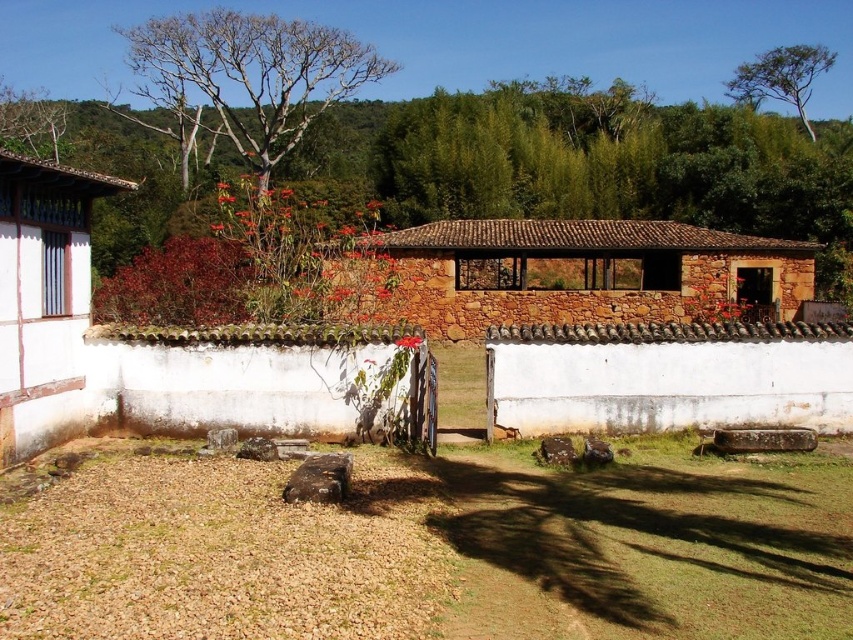
Question: Is brown grass at lower center further to camera compared to bare wood tree at upper left?

Choices:
 (A) yes
 (B) no

Answer: (B)

Question: Can you confirm if brown grass at lower center is positioned above bare wood tree at upper left?

Choices:
 (A) yes
 (B) no

Answer: (B)

Question: Based on their relative distances, which object is farther from the brown grass at lower center?

Choices:
 (A) green leafy tree at upper right
 (B) bare wood tree at upper left

Answer: (A)

Question: Based on their relative distances, which object is nearer to the brown grass at lower center?

Choices:
 (A) green leafy tree at upper right
 (B) bare wood tree at upper left

Answer: (B)

Question: Among these objects, which one is farthest from the camera?

Choices:
 (A) green leafy tree at upper right
 (B) bare wood tree at upper left
 (C) brown grass at lower center

Answer: (A)

Question: Does bare wood tree at upper left appear under green leafy tree at upper right?

Choices:
 (A) no
 (B) yes

Answer: (B)